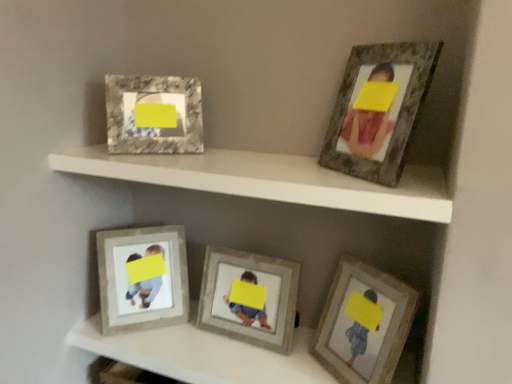
Find the location of `vacant location below matte gray frame at upper center (from a real-world perspective)`. vacant location below matte gray frame at upper center (from a real-world perspective) is located at coordinates (219, 352).